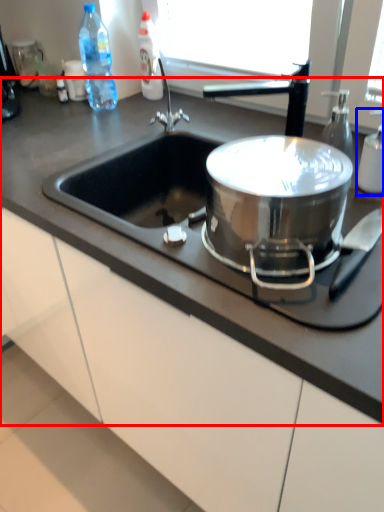
Question: Which of the following is the closest to the observer, countertop (highlighted by a red box) or bottle (highlighted by a blue box)?

Choices:
 (A) countertop
 (B) bottle

Answer: (A)